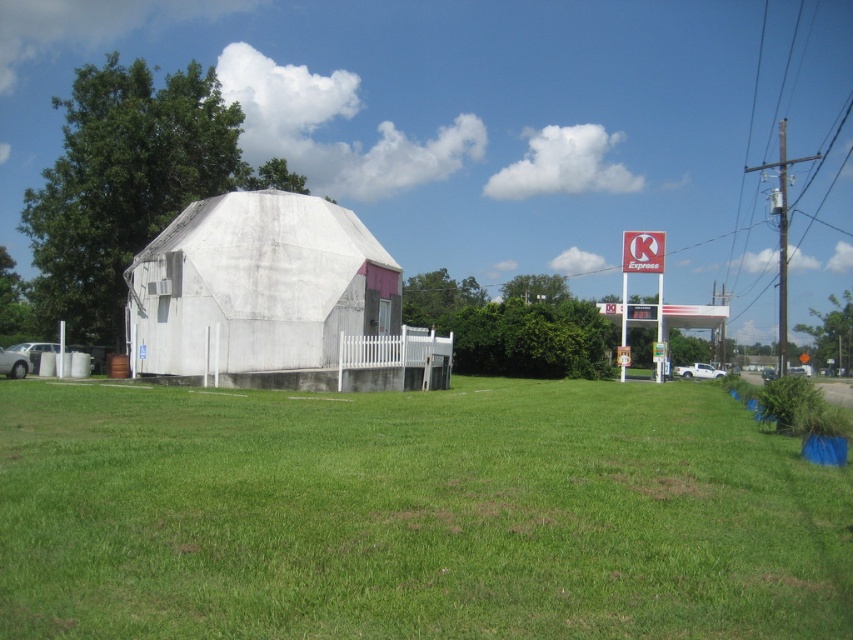
Question: Is green grass at center positioned at the back of white matte dome at center?

Choices:
 (A) yes
 (B) no

Answer: (B)

Question: Among these objects, which one is nearest to the camera?

Choices:
 (A) green grass at center
 (B) white matte dome at center

Answer: (A)

Question: Which point is farther from the camera taking this photo?

Choices:
 (A) (225, 285)
 (B) (773, 602)

Answer: (A)

Question: From the image, what is the correct spatial relationship of green grass at center in relation to white matte dome at center?

Choices:
 (A) above
 (B) below

Answer: (B)

Question: Can you confirm if green grass at center is thinner than white matte dome at center?

Choices:
 (A) yes
 (B) no

Answer: (B)